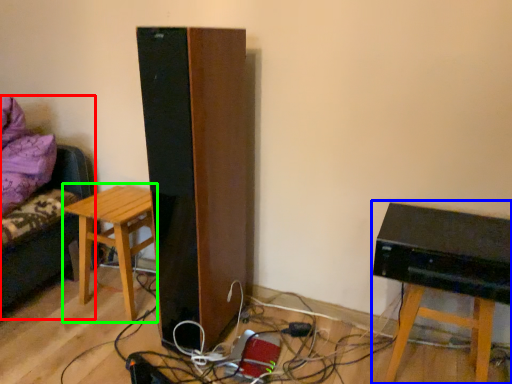
Question: Estimate the real-world distances between objects in this image. Which object is farther from furniture (highlighted by a red box), computer (highlighted by a blue box) or stool (highlighted by a green box)?

Choices:
 (A) computer
 (B) stool

Answer: (A)